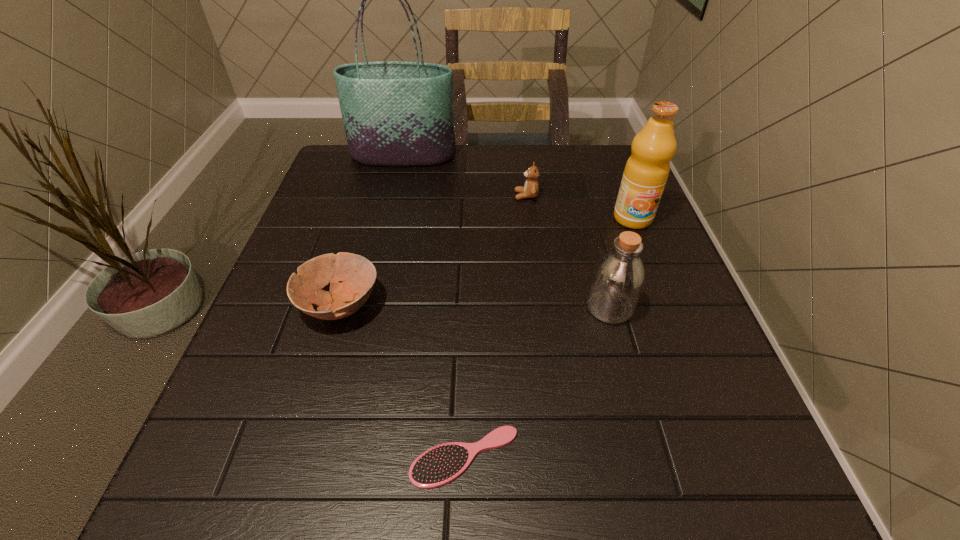
At what (x,y) coordinates should I click in order to perform the action: click on the shortest object. Please return your answer as a coordinate pair (x, y). This screenshot has width=960, height=540. Looking at the image, I should click on (439, 465).

This screenshot has width=960, height=540. Identify the location of vacant space situated on the front of the farthest object. (387, 224).

Identify the location of free spot located on the front label of the rightmost object. This screenshot has width=960, height=540. (676, 327).

This screenshot has width=960, height=540. In order to click on vacant space located 0.280m on the back of the fifth object from left to right in this screenshot , I will do `click(582, 206)`.

Where is `blank space located 0.370m on the front-facing side of the fourth tallest object`? The image size is (960, 540). blank space located 0.370m on the front-facing side of the fourth tallest object is located at coordinates (367, 196).

I want to click on vacant area situated on the front-facing side of the fourth tallest object, so (x=378, y=196).

At what (x,y) coordinates should I click in order to perform the action: click on vacant area situated 0.180m on the front-facing side of the fourth tallest object. Please return your answer as a coordinate pair (x, y). The width and height of the screenshot is (960, 540). Looking at the image, I should click on (443, 196).

Find the location of `blank area located 0.190m on the front of the second shortest object`. blank area located 0.190m on the front of the second shortest object is located at coordinates (300, 440).

In order to click on free space located on the back of the hairbrush in this screenshot , I will do `click(468, 304)`.

Locate an element on the screen. Image resolution: width=960 pixels, height=540 pixels. tote bag located in the far edge section of the desktop is located at coordinates (395, 113).